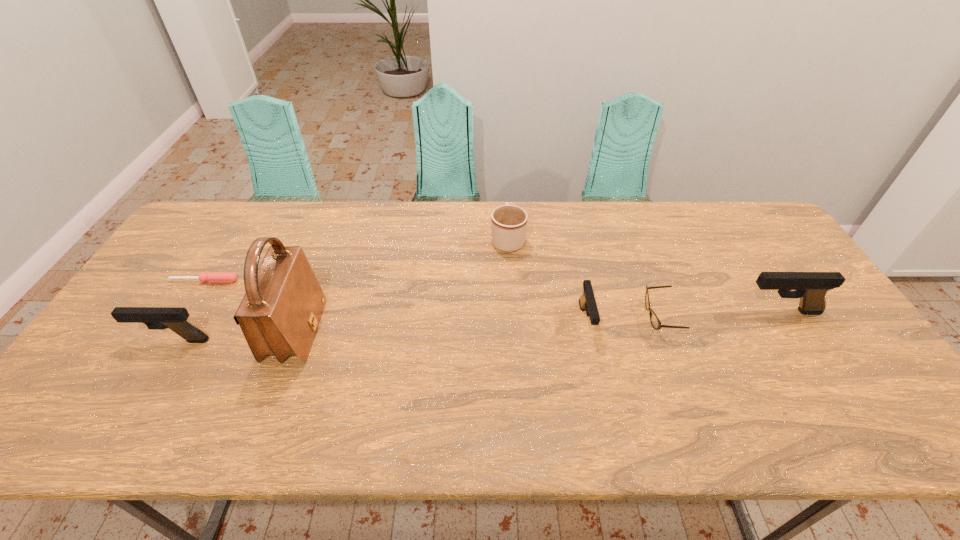
Find the location of `the tallest object`. the tallest object is located at coordinates (279, 314).

In order to click on spectacles in this screenshot , I will do `click(656, 324)`.

Find the location of a particular element. the second shortest object is located at coordinates (656, 324).

Locate an element on the screen. vacant space located 0.080m on the front-facing side of the second shortest pistol is located at coordinates (106, 340).

You are a GUI agent. You are given a task and a screenshot of the screen. Output one action in this format:
    pyautogui.click(x=<x>, y=<y>)
    Task: Click on the vacant space located 0.050m on the front-facing side of the second shortest pistol
    
    Given the screenshot: What is the action you would take?
    pyautogui.click(x=117, y=340)

You are a GUI agent. You are given a task and a screenshot of the screen. Output one action in this format:
    pyautogui.click(x=<x>, y=<y>)
    Task: Click on the vacant area situated 0.080m on the front-facing side of the fifth object from left to right
    
    Given the screenshot: What is the action you would take?
    pyautogui.click(x=596, y=370)

Find the location of a particular element. free space located on the front-facing side of the rightmost pistol is located at coordinates (615, 312).

Find the location of a particular element. The height and width of the screenshot is (540, 960). free point located on the front-facing side of the rightmost pistol is located at coordinates (634, 312).

The width and height of the screenshot is (960, 540). What are the coordinates of `vacant space situated on the front-facing side of the rightmost pistol` in the screenshot? It's located at (670, 312).

The image size is (960, 540). Find the location of `vacant area situated 0.200m on the right of the sixth nearest object`. vacant area situated 0.200m on the right of the sixth nearest object is located at coordinates (306, 281).